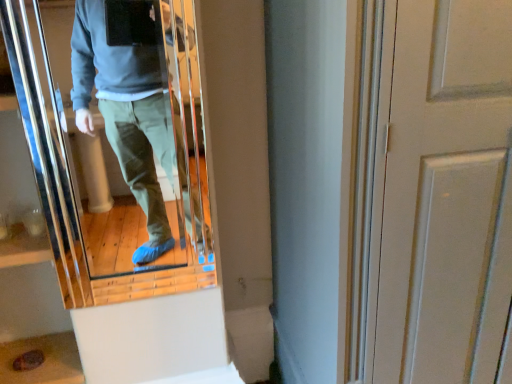
Question: Is white matte door at center right in contact with matte glass mirror at center?

Choices:
 (A) yes
 (B) no

Answer: (B)

Question: Does white matte door at center right have a lesser width compared to matte glass mirror at center?

Choices:
 (A) yes
 (B) no

Answer: (B)

Question: Can you confirm if white matte door at center right is taller than matte glass mirror at center?

Choices:
 (A) no
 (B) yes

Answer: (B)

Question: Is white matte door at center right positioned behind matte glass mirror at center?

Choices:
 (A) yes
 (B) no

Answer: (B)

Question: Is white matte door at center right positioned with its back to matte glass mirror at center?

Choices:
 (A) yes
 (B) no

Answer: (B)

Question: Is white matte door at center right at the right side of matte glass mirror at center?

Choices:
 (A) yes
 (B) no

Answer: (A)

Question: From a real-world perspective, is matte glass mirror at center under white matte door at center right?

Choices:
 (A) yes
 (B) no

Answer: (B)

Question: Is matte glass mirror at center turned away from white matte door at center right?

Choices:
 (A) yes
 (B) no

Answer: (B)

Question: Does matte glass mirror at center have a larger size compared to white matte door at center right?

Choices:
 (A) no
 (B) yes

Answer: (A)

Question: Is matte glass mirror at center further to the viewer compared to white matte door at center right?

Choices:
 (A) yes
 (B) no

Answer: (A)

Question: Is the position of matte glass mirror at center less distant than that of white matte door at center right?

Choices:
 (A) yes
 (B) no

Answer: (B)

Question: Considering the relative sizes of matte glass mirror at center and white matte door at center right in the image provided, is matte glass mirror at center taller than white matte door at center right?

Choices:
 (A) yes
 (B) no

Answer: (B)

Question: Considering their positions, is white matte door at center right located in front of or behind matte glass mirror at center?

Choices:
 (A) front
 (B) behind

Answer: (A)